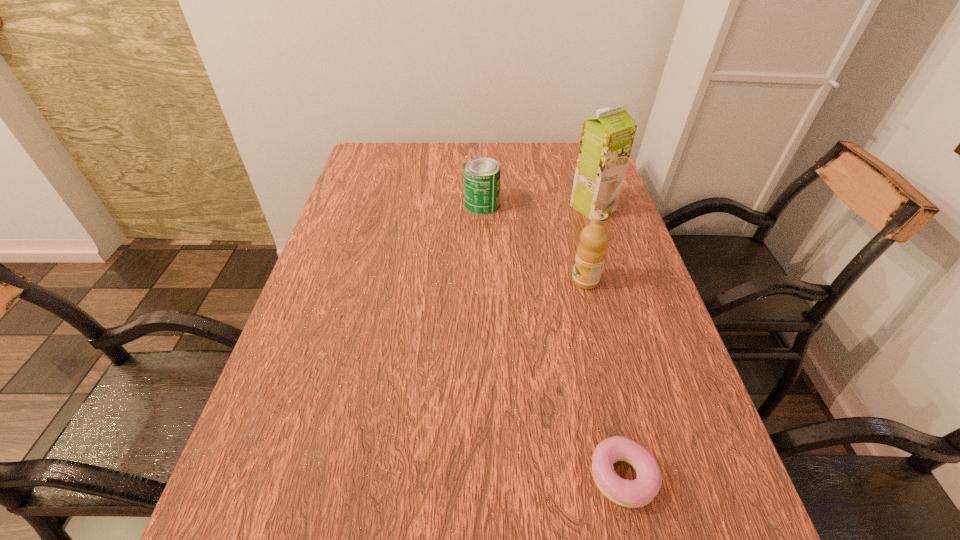
At what (x,y) coordinates should I click in order to perform the action: click on soya milk. Please return your answer as a coordinate pair (x, y). Looking at the image, I should click on (606, 141).

Locate an element on the screen. The image size is (960, 540). olive oil is located at coordinates (591, 252).

The width and height of the screenshot is (960, 540). I want to click on the second tallest object, so click(591, 252).

Locate an element on the screen. The image size is (960, 540). the second shortest object is located at coordinates (482, 175).

Identify the location of the leftmost object. This screenshot has height=540, width=960. (482, 175).

The image size is (960, 540). I want to click on the shortest object, so click(x=636, y=493).

This screenshot has width=960, height=540. What are the coordinates of `doughnut` in the screenshot? It's located at (636, 493).

Find the location of `free space located 0.290m on the left of the tallest object`. free space located 0.290m on the left of the tallest object is located at coordinates (472, 207).

Identify the location of free spot located on the label of the olive oil. pyautogui.click(x=420, y=281).

This screenshot has height=540, width=960. I want to click on vacant space located 0.140m on the label of the olive oil, so click(x=515, y=281).